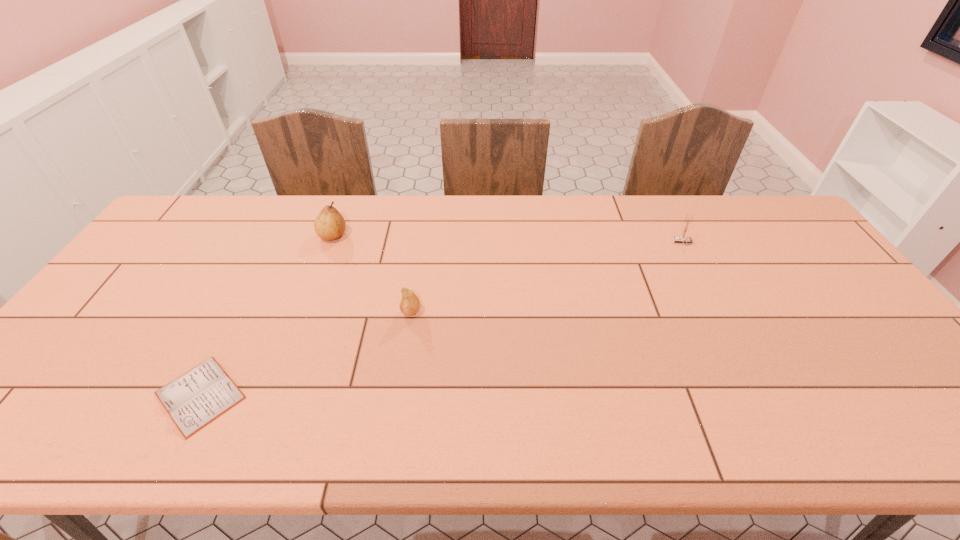
What are the coordinates of `vacant position located 0.110m on the right of the leftmost object` in the screenshot? It's located at (296, 395).

The image size is (960, 540). I want to click on object situated at the far edge, so click(x=329, y=225).

This screenshot has height=540, width=960. What are the coordinates of `object that is at the near edge` in the screenshot? It's located at (193, 400).

Where is `vacant space at the far edge of the desktop`? vacant space at the far edge of the desktop is located at coordinates (414, 215).

Image resolution: width=960 pixels, height=540 pixels. I want to click on vacant region at the left edge of the desktop, so click(x=88, y=384).

Where is `free location at the right edge of the desktop`? The image size is (960, 540). free location at the right edge of the desktop is located at coordinates (808, 261).

Locate an element on the screen. free space at the far left corner is located at coordinates (174, 238).

Identify the location of unoccupied area between the farther pear and the rightmost object. (508, 239).

This screenshot has width=960, height=540. In order to click on unoccupied area between the leftmost object and the matchbox in this screenshot , I will do `click(442, 319)`.

Where is `free space between the third object from right to left and the nearest object`? The width and height of the screenshot is (960, 540). free space between the third object from right to left and the nearest object is located at coordinates (267, 315).